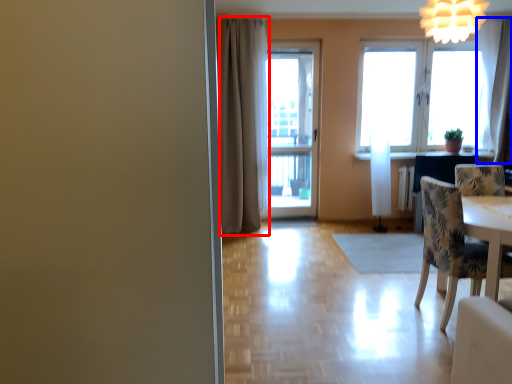
Question: Which object is closer to the camera taking this photo, curtain (highlighted by a red box) or curtain (highlighted by a blue box)?

Choices:
 (A) curtain
 (B) curtain

Answer: (A)